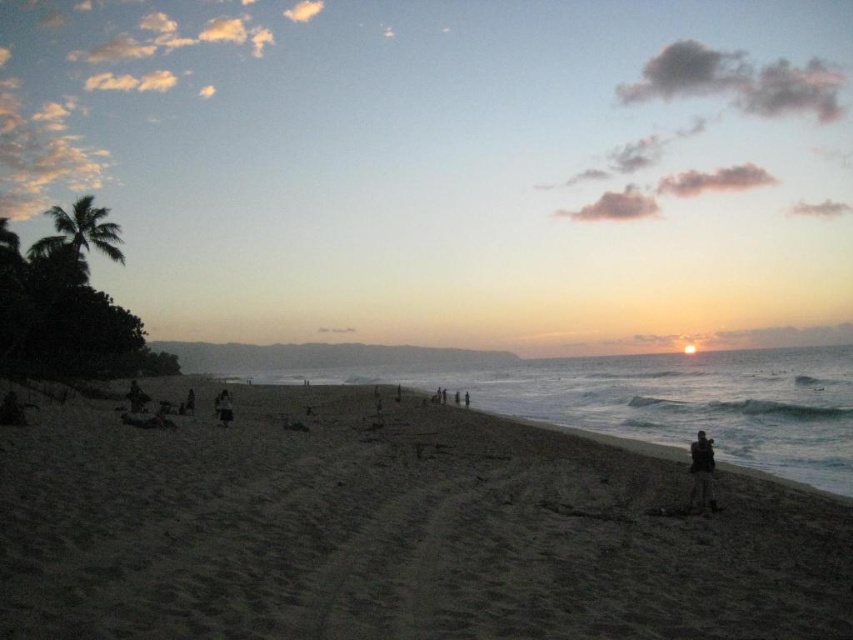
Measure the distance between green leafy palm tree at upper left and silhouette figure at center.

They are 66.03 meters apart.

In the scene shown: Does green leafy palm tree at upper left have a larger size compared to silhouette figure at center?

Yes, green leafy palm tree at upper left is bigger than silhouette figure at center.

Between point (30, 259) and point (216, 396), which one is positioned in front?

Point (30, 259) is in front.

At what (x,y) coordinates should I click in order to perform the action: click on green leafy palm tree at upper left. Please return your answer as a coordinate pair (x, y). This screenshot has height=640, width=853. Looking at the image, I should click on (76, 241).

What do you see at coordinates (701, 472) in the screenshot? Image resolution: width=853 pixels, height=640 pixels. I see `dark gray fabric person at lower right` at bounding box center [701, 472].

Between dark gray fabric person at lower right and silhouette figure at center, which one is positioned higher?

Positioned higher is dark gray fabric person at lower right.

Does point (706, 467) come behind point (225, 412)?

No.

What are the coordinates of `dark gray fabric person at lower right` in the screenshot? It's located at (701, 472).

Which is above, silhouette figure at center or dark skin human at center-left?

Positioned higher is dark skin human at center-left.

In order to click on silhouette figure at center in this screenshot , I will do `click(223, 406)`.